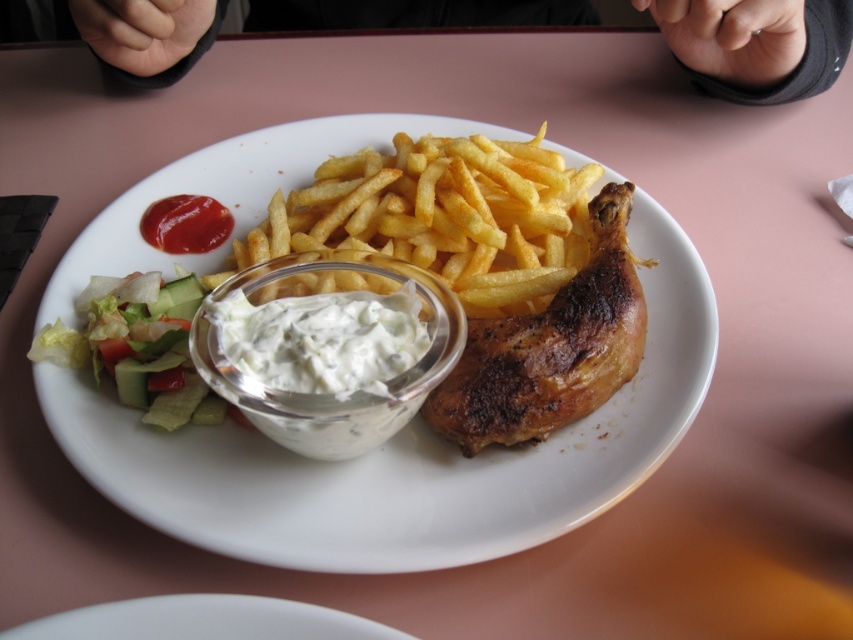
Question: Can you confirm if white matte plate at center is positioned below brown crispy chicken leg at center?

Choices:
 (A) no
 (B) yes

Answer: (A)

Question: Among these points, which one is nearest to the camera?

Choices:
 (A) (554, 164)
 (B) (556, 440)

Answer: (B)

Question: Does white matte plate at center have a lesser width compared to fresh green salad at left?

Choices:
 (A) yes
 (B) no

Answer: (B)

Question: Does golden crispy french fries at center have a greater width compared to fresh green salad at left?

Choices:
 (A) yes
 (B) no

Answer: (A)

Question: Which of the following is the farthest from the observer?

Choices:
 (A) (428, 243)
 (B) (689, 413)

Answer: (A)

Question: Which point is closer to the camera taking this photo?

Choices:
 (A) (447, 424)
 (B) (149, 252)

Answer: (A)